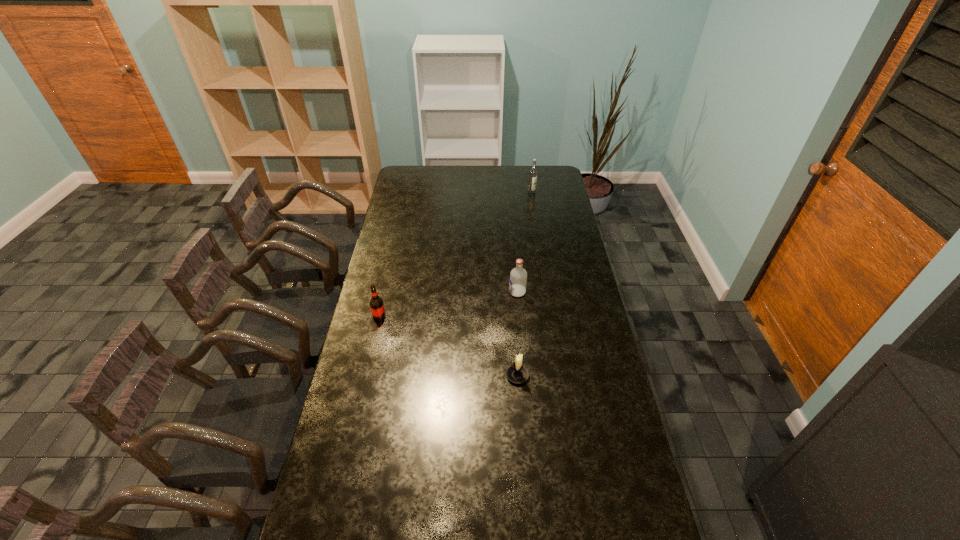
Where is `blank region between the root beer and the third nearest object`? The image size is (960, 540). blank region between the root beer and the third nearest object is located at coordinates (448, 305).

The width and height of the screenshot is (960, 540). I want to click on vacant space that's between the nearer vodka and the third farthest object, so click(x=448, y=305).

The width and height of the screenshot is (960, 540). Find the location of `unoccupied area between the nearer vodka and the rightmost object`. unoccupied area between the nearer vodka and the rightmost object is located at coordinates (524, 242).

You are a GUI agent. You are given a task and a screenshot of the screen. Output one action in this format:
    pyautogui.click(x=<x>, y=<y>)
    Task: Click on the empty space that is in between the left vodka and the right vodka
    
    Given the screenshot: What is the action you would take?
    pyautogui.click(x=524, y=242)

You are a GUI agent. You are given a task and a screenshot of the screen. Output one action in this format:
    pyautogui.click(x=<x>, y=<y>)
    Task: Click on the unoccupied area between the right vodka and the third farthest object
    This screenshot has width=960, height=540.
    Given the screenshot: What is the action you would take?
    456,254

Locate an element on the screen. Image resolution: width=960 pixels, height=540 pixels. object identified as the second closest to the shortest object is located at coordinates (376, 304).

Where is `object that is the third closest one to the shortest object`? The width and height of the screenshot is (960, 540). object that is the third closest one to the shortest object is located at coordinates (533, 172).

The width and height of the screenshot is (960, 540). In order to click on vacant space that satisfies the following two spatial constraints: 1. on the label of the nearer vodka; 2. on the front side of the nearest object in this screenshot , I will do click(524, 376).

Locate an element on the screen. free space that satisfies the following two spatial constraints: 1. on the label of the farther vodka; 2. on the label of the third nearest object is located at coordinates (547, 292).